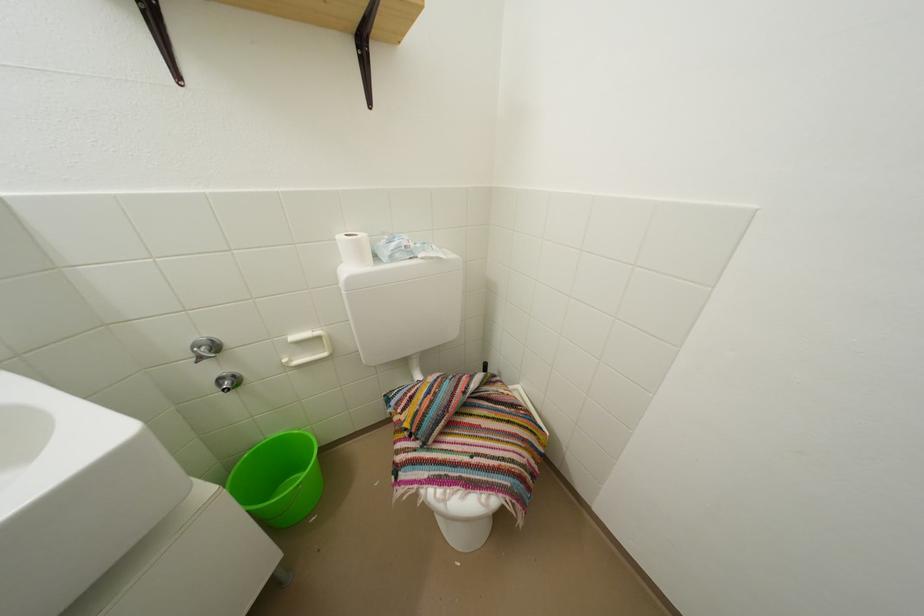
The width and height of the screenshot is (924, 616). What do you see at coordinates (227, 381) in the screenshot?
I see `the chrome water knob` at bounding box center [227, 381].